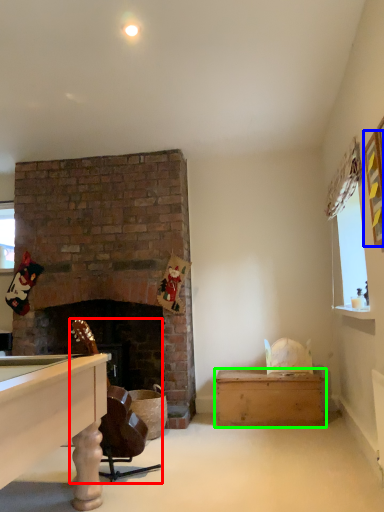
Question: Which object is the farthest from rocking chair (highlighted by a red box)? Choose among these: picture frame (highlighted by a blue box) or table (highlighted by a green box).

Choices:
 (A) picture frame
 (B) table

Answer: (A)